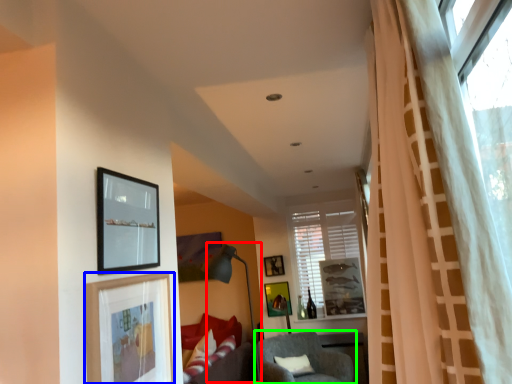
Question: Which object is the farthest from lamp (highlighted by a red box)? Choose among these: picture frame (highlighted by a blue box) or chair (highlighted by a green box).

Choices:
 (A) picture frame
 (B) chair

Answer: (A)